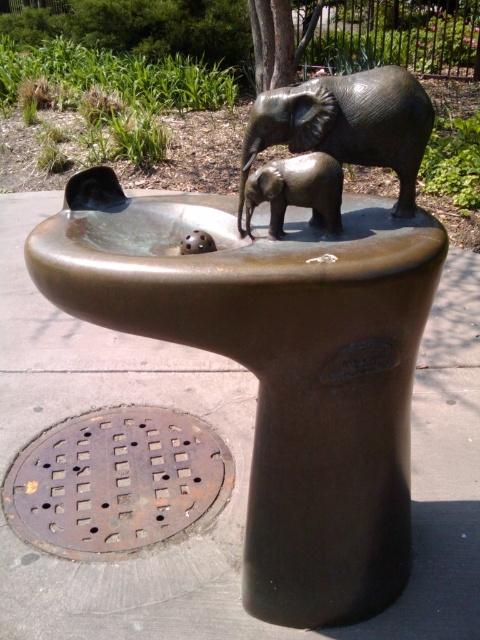
You are standing in front of the bronze sculpture of two elephants. There is a point marked at coordinates (276, 368). Based on the scene description, what part of the sculpture does this point likely belong to?

The point at (276, 368) is on the bronze textured elephant at upper center.

You are standing in front of the bronze sculpture of two elephants. The adult elephant is positioned slightly behind the calf. If you want to touch the bronze textured elephant at center, which direction should you move relative to the calf?

The bronze textured elephant at center is located at point (347, 124). Since the adult is behind the calf, moving towards the center point would mean moving backward from the calf to reach the adult elephant.